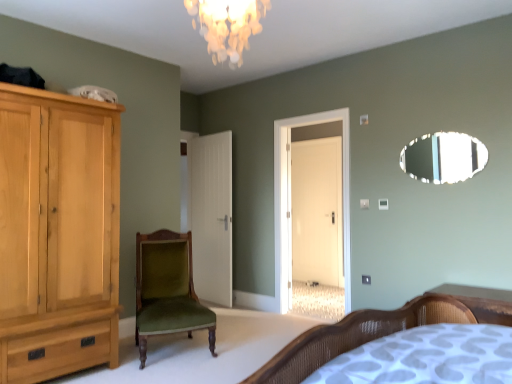
Find the location of `vacant region to the right of green velvet chair at center`. vacant region to the right of green velvet chair at center is located at coordinates (241, 344).